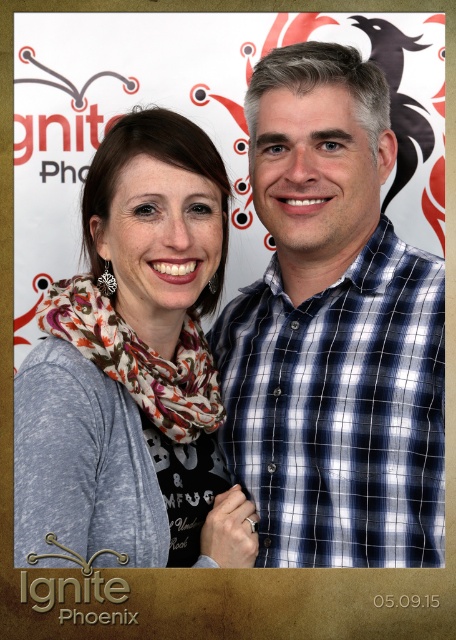
Can you confirm if printed scarf at center is taller than floral print scarf at upper left?

Correct, printed scarf at center is much taller as floral print scarf at upper left.

Can you confirm if printed scarf at center is positioned above floral print scarf at upper left?

Indeed, printed scarf at center is positioned over floral print scarf at upper left.

Who is more forward, (x=122, y=552) or (x=148, y=392)?

Point (x=122, y=552) is in front.

Locate an element on the screen. Image resolution: width=456 pixels, height=640 pixels. printed scarf at center is located at coordinates (134, 369).

This screenshot has height=640, width=456. Describe the element at coordinates (333, 332) in the screenshot. I see `blue checkered shirt at center` at that location.

Between point (276, 346) and point (91, 296), which one is positioned behind?

Point (276, 346)

The image size is (456, 640). What are the coordinates of `blue checkered shirt at center` in the screenshot? It's located at [x=333, y=332].

Is blue checkered shirt at center shorter than printed scarf at center?

No, blue checkered shirt at center is not shorter than printed scarf at center.

Which is more to the right, blue checkered shirt at center or printed scarf at center?

From the viewer's perspective, blue checkered shirt at center appears more on the right side.

Which is in front, point (326, 230) or point (98, 432)?

Point (98, 432)

Find the location of a particular element. The width and height of the screenshot is (456, 640). blue checkered shirt at center is located at coordinates (333, 332).